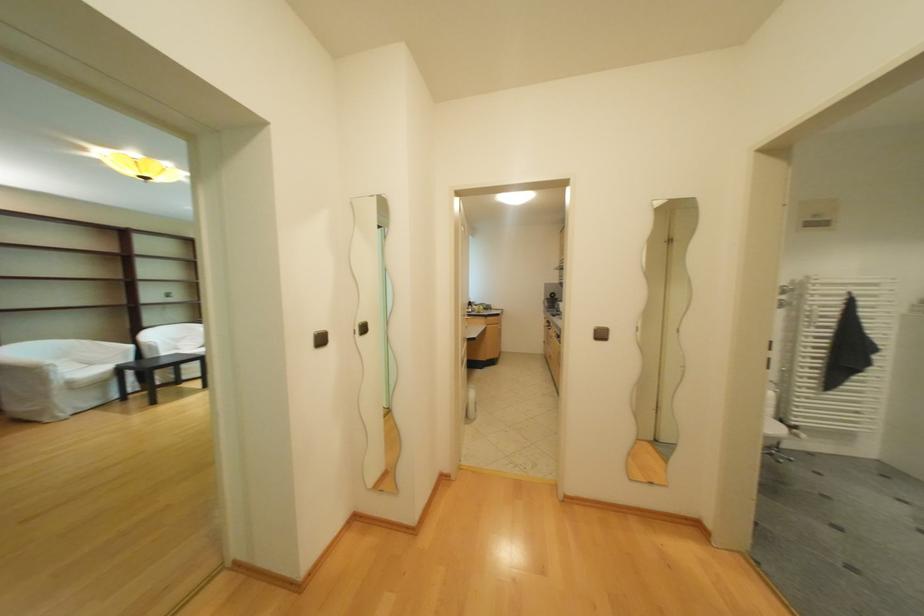
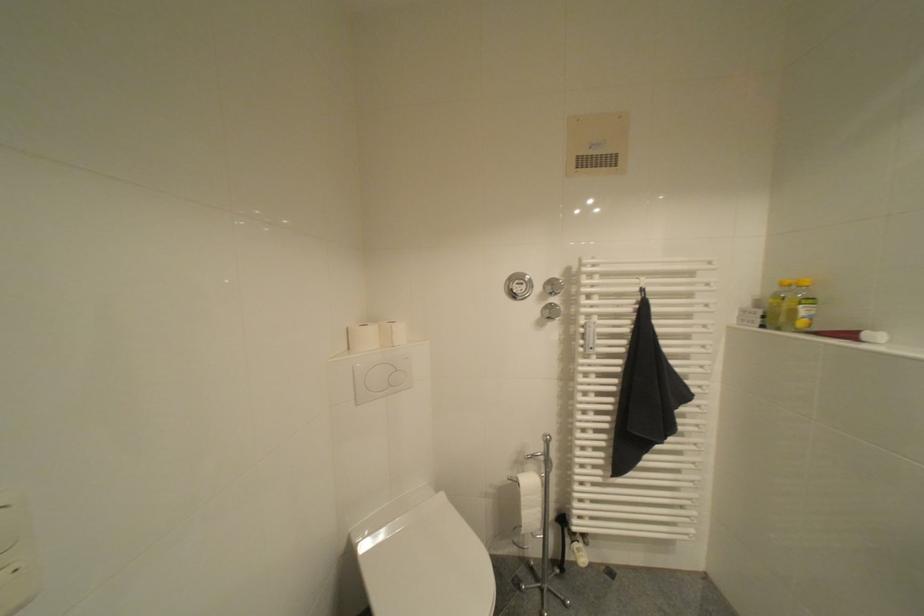
In a continuous first-person perspective shot, in which direction is the camera moving?

The cameraman walked toward right, forward.